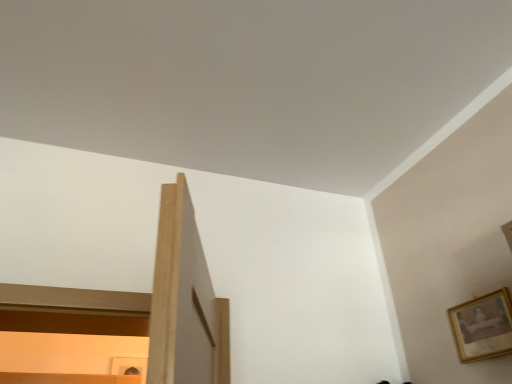
What is the approximate height of gold-framed picture at upper right?

It is 7.65 inches.

Image resolution: width=512 pixels, height=384 pixels. Identify the location of gold-framed picture at upper right. tap(483, 326).

Image resolution: width=512 pixels, height=384 pixels. Describe the element at coordinates (483, 326) in the screenshot. I see `gold-framed picture at upper right` at that location.

I want to click on gold-framed picture at upper right, so click(483, 326).